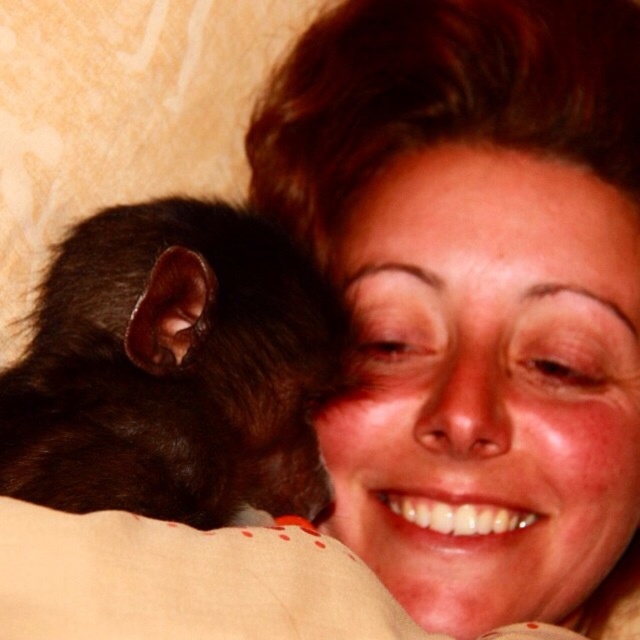
From the picture: You are a photographer trying to capture a clear shot of the black furry mouse at left and the matte black fur at upper center. Which object should you focus on first to ensure both are in focus?

You should focus on the matte black fur at upper center first because it is positioned over the black furry mouse at left, meaning it is closer to the camera. By focusing on the closer object, the mouse at left will also be within the depth of field.